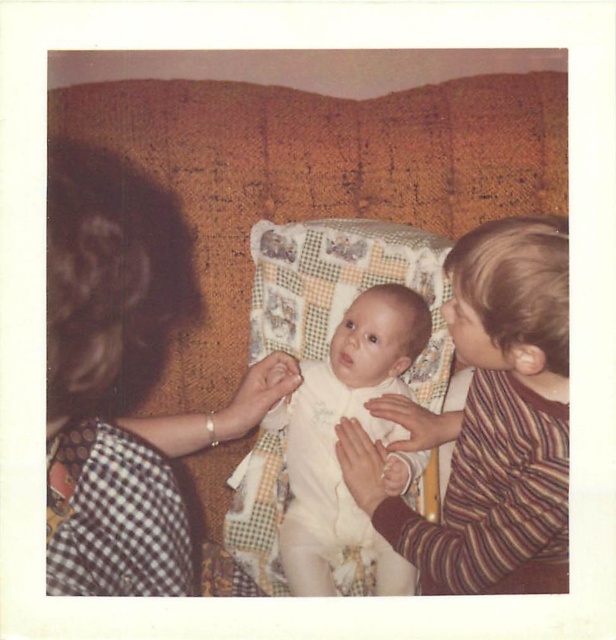
You are a photographer setting up a photo shoot in this scene. You need to ensure that the black dotted dress at left and the white smooth onesie at center are both visible in the frame. Given their sizes, which clothing item requires more space in the composition?

The black dotted dress at left requires more space in the composition because its width is larger than the white smooth onesie at center.

In the scene shown: You are a fashion designer observing the scene. You need to determine which clothing item has a larger size between the black dotted dress at left and the white smooth onesie at center. Which one is bigger?

The black dotted dress at left is bigger than the white smooth onesie at center.

You are a photographer trying to capture a candid shot of the baby in the high chair. You need to ensure that the black dotted dress at left and the white smooth onesie at center are both in focus. Given that your camera can only focus on objects within a 10 inch range, will both items be in focus?

The distance between the black dotted dress at left and the white smooth onesie at center is 8.35 inches, which is within the 10 inch range. Therefore, both items will be in focus.